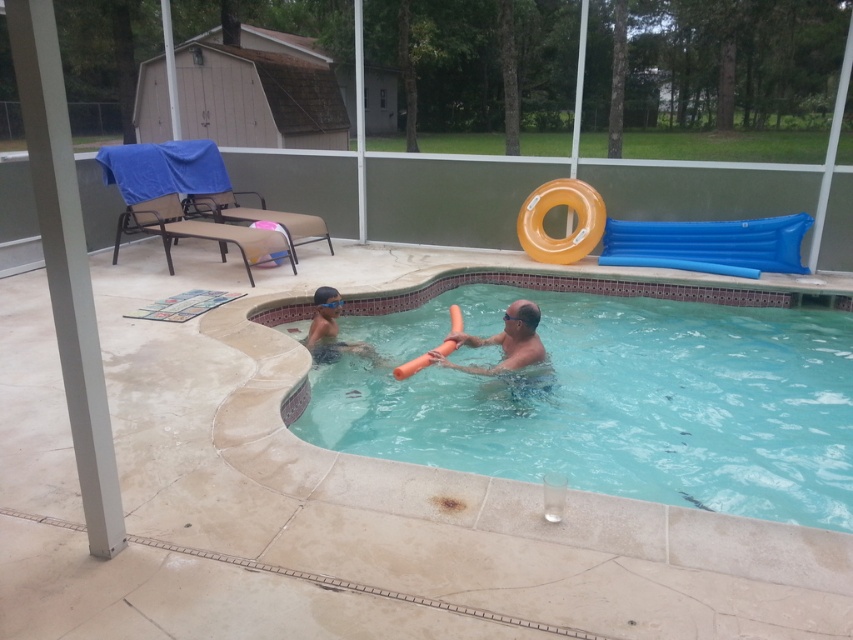
Where is the clear plastic pool at center located in the image?

The clear plastic pool at center is located at point 0.616 on the x axis and 0.720 on the y axis.

Consider the image. What is located at the coordinates point (509,352)?

The point (509,352) is on the orange foam float at center.